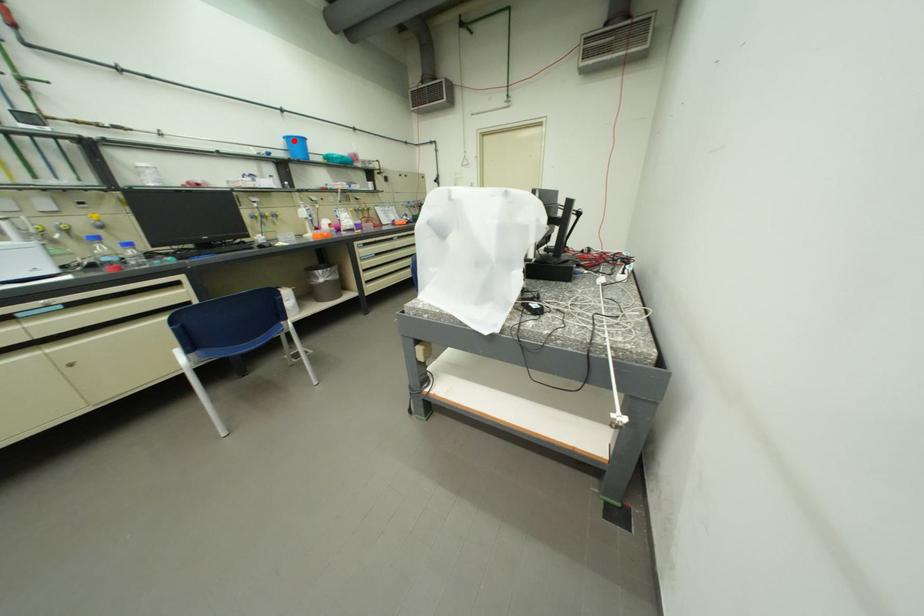
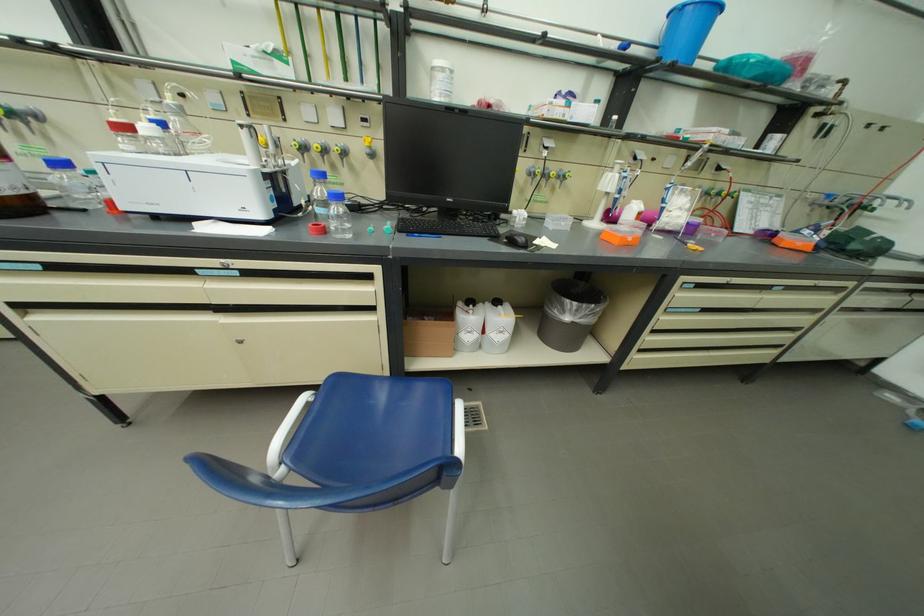
Question: I am providing you with two images of the same scene from different viewpoints. In image1, a red point is highlighted. Considering the same 3D point in image2, which of the following is correct?

Choices:
 (A) It is closer
 (B) It is farther

Answer: (B)